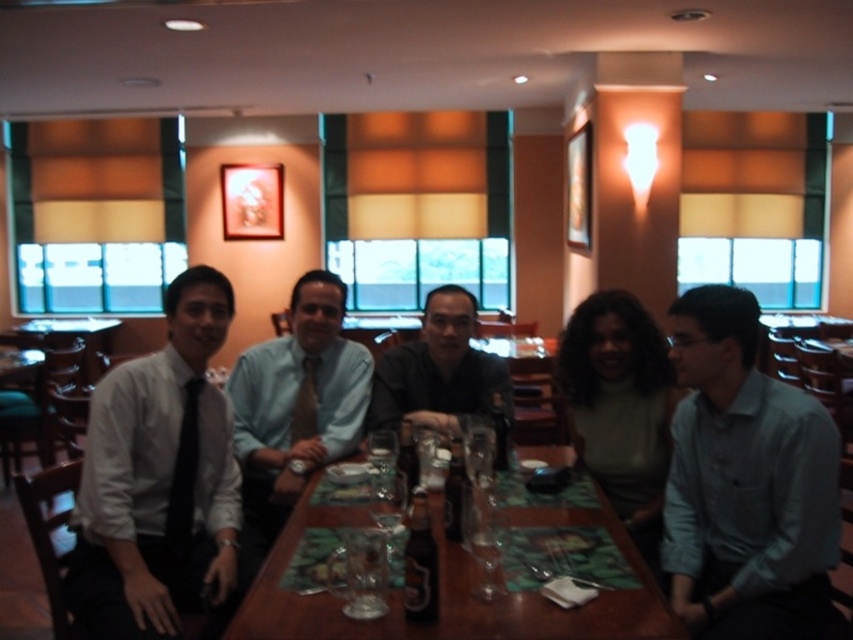
Between light blue shirt at center and matte gray shirt at center, which one appears on the left side from the viewer's perspective?

From the viewer's perspective, light blue shirt at center appears more on the left side.

Which is more to the right, light blue shirt at center or matte gray shirt at center?

matte gray shirt at center is more to the right.

Between point (303, 387) and point (496, 404), which one is positioned in front?

Point (496, 404) is more forward.

Where is `light blue shirt at center`? The image size is (853, 640). light blue shirt at center is located at coordinates (299, 392).

Is point (244, 604) closer to camera compared to point (310, 385)?

Yes, point (244, 604) is in front of point (310, 385).

Is point (543, 518) behind point (305, 401)?

That is False.

This screenshot has width=853, height=640. Describe the element at coordinates (451, 588) in the screenshot. I see `wooden table at center` at that location.

Identify the location of wooden table at center. (451, 588).

Between gray cotton shirt at right and matte gray shirt at center, which one appears on the right side from the viewer's perspective?

Positioned to the right is gray cotton shirt at right.

Does gray cotton shirt at right have a lesser height compared to matte gray shirt at center?

In fact, gray cotton shirt at right may be taller than matte gray shirt at center.

Between point (819, 440) and point (473, 321), which one is positioned behind?

The point (473, 321) is more distant.

This screenshot has height=640, width=853. Find the location of `gray cotton shirt at right`. gray cotton shirt at right is located at coordinates (746, 483).